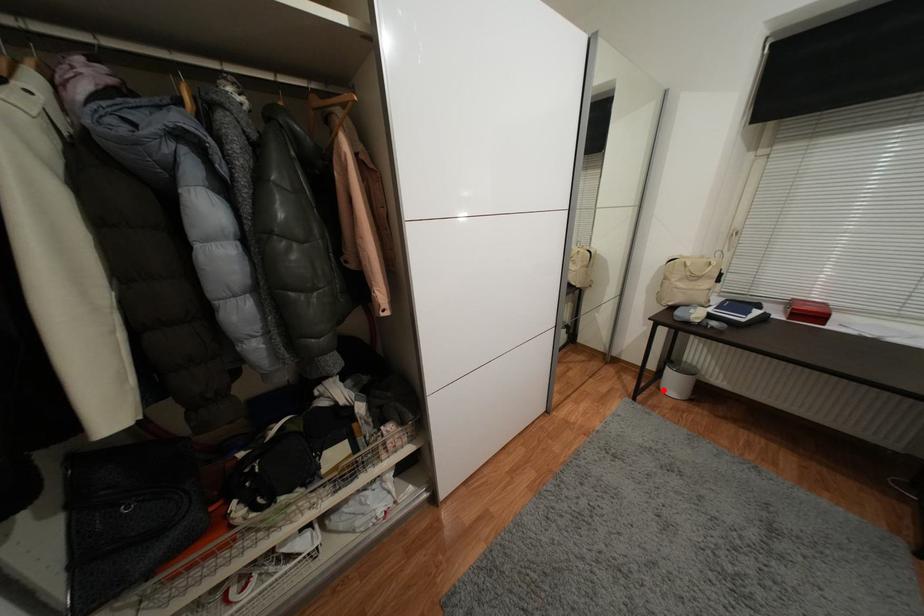
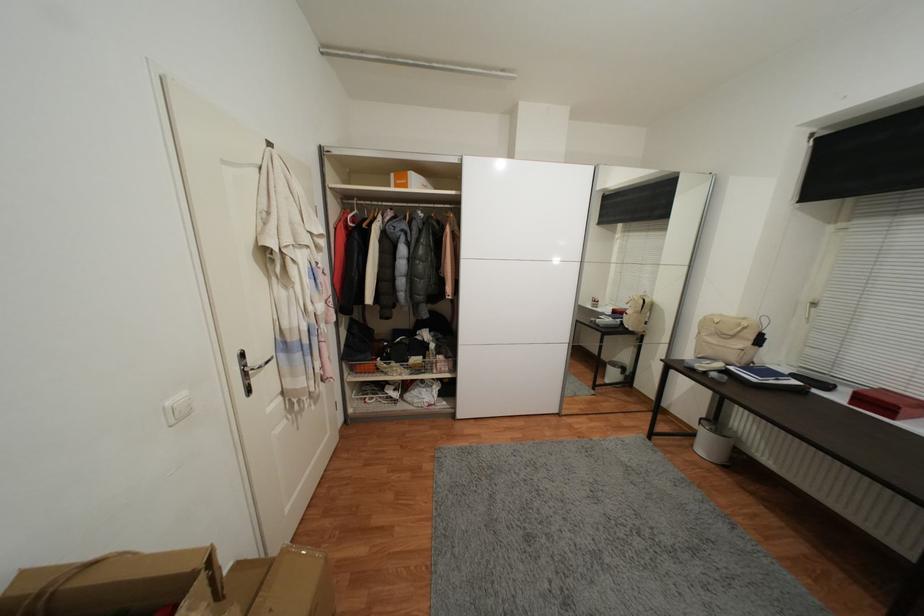
Question: I am providing you with two images of the same scene from different viewpoints. A red point is shown in image1. For the corresponding object point in image2, is it positioned nearer or farther from the camera?

Choices:
 (A) Nearer
 (B) Farther

Answer: (A)